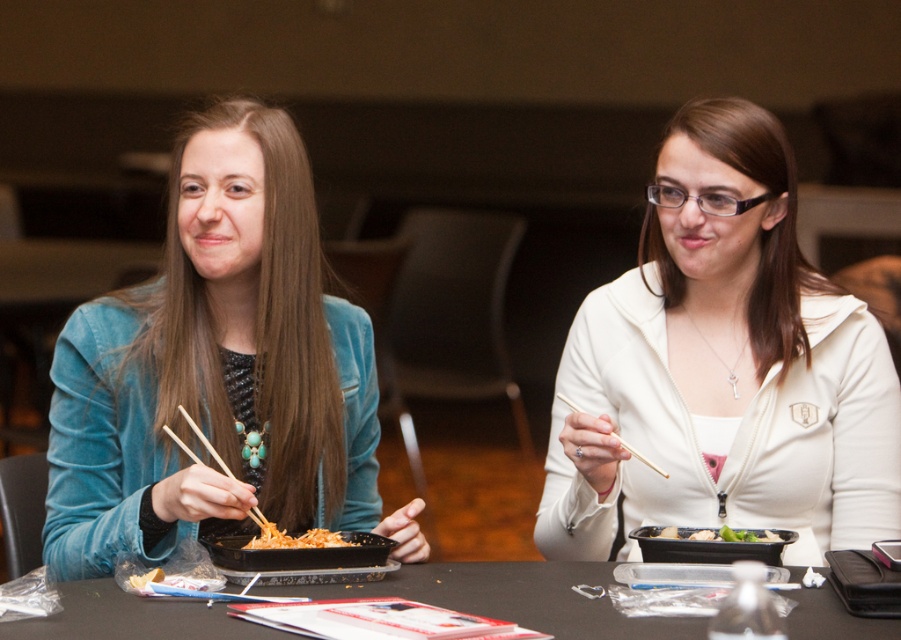
You are standing 1.5 meters away from the table. You want to pick up the item at point (248, 544). Can you reach it without moving closer?

The distance of point (248, 544) from camera is 1.49 meters, so you are already 1.5 meters away from the table. Therefore, you can reach the item at point (248, 544) without moving closer.

You are a server at a restaurant and need to place a new dish on the table. The dish is too hot to handle, so you must place it on the black matte tray at center without touching the wooden chopsticks at left. Is this possible?

The black matte tray at center is positioned under the wooden chopsticks at left, so placing the hot dish on the tray would require moving the chopsticks first to avoid contact. Therefore, it is not possible to place the dish directly on the tray without disturbing the wooden chopsticks at left.

You are a server checking the table. The black plastic tray at center and the wooden chopsticks at upper center are on the table. Which object has a greater height?

The wooden chopsticks at upper center are taller than the black plastic tray at center.